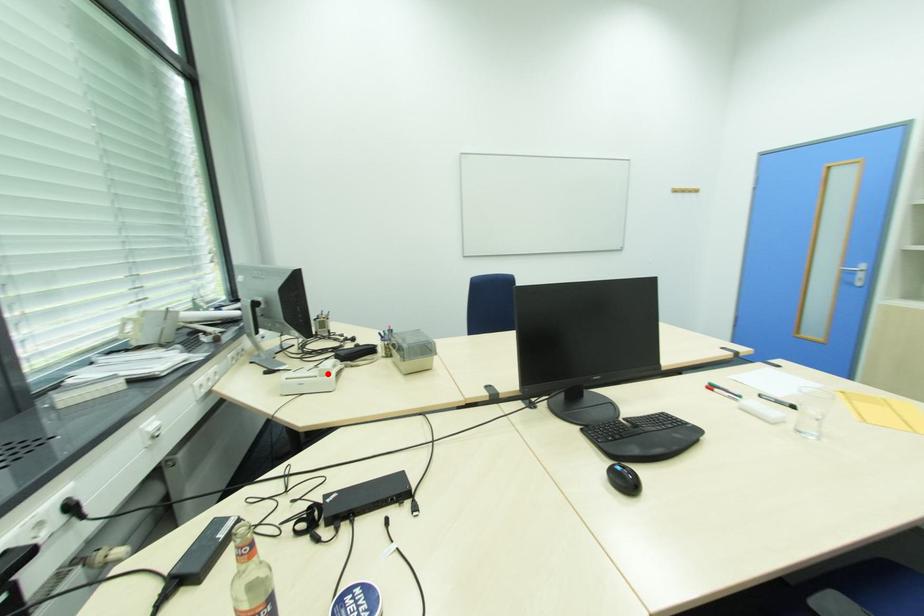
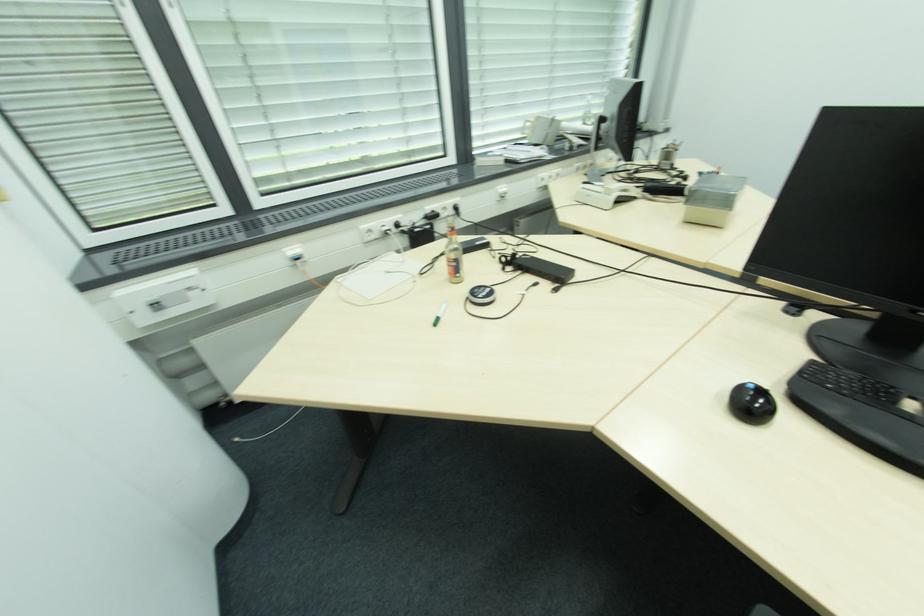
Where in the second image is the point corresponding to the highlighted location from the first image?

(612, 193)